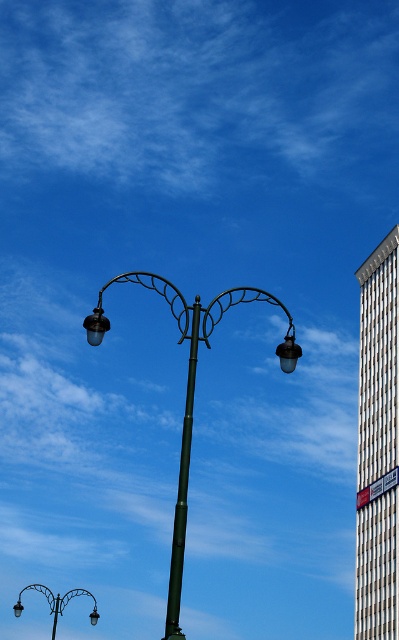
Question: Considering the real-world distances, which object is farthest from the metallic green street light at center?

Choices:
 (A) green metallic pole at center
 (B) matte black lamp at upper left

Answer: (B)

Question: Which object appears closest to the camera in this image?

Choices:
 (A) matte black street light at center
 (B) metallic green street light at center

Answer: (B)

Question: Does matte black street light at center have a larger size compared to matte black lamp at center?

Choices:
 (A) no
 (B) yes

Answer: (B)

Question: Does matte black street light at center have a larger size compared to metallic silver street sign at upper right?

Choices:
 (A) no
 (B) yes

Answer: (B)

Question: Which is farther from the green metallic pole at center?

Choices:
 (A) metallic green street light at center
 (B) white textured building at right
 (C) matte black lamp at center

Answer: (B)

Question: Can you confirm if white textured building at right is bigger than green metallic pole at center?

Choices:
 (A) no
 (B) yes

Answer: (B)